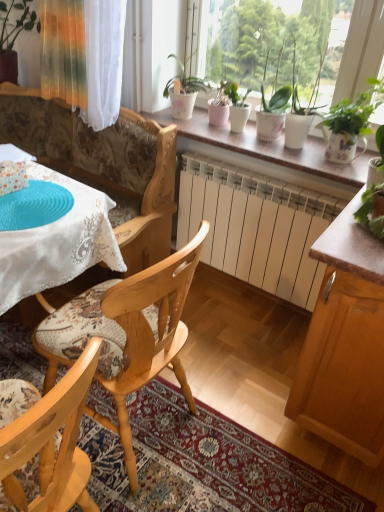
Find the location of a particular element. unoccupied space behind wooden placemat at lower center is located at coordinates (235, 359).